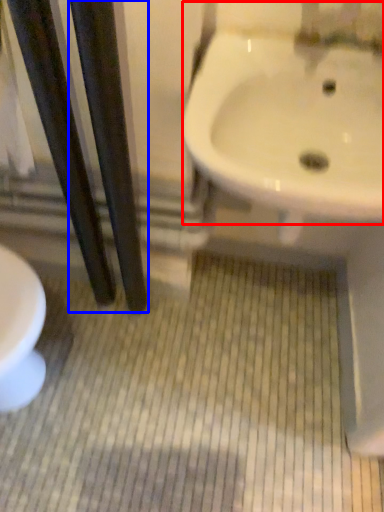
Question: Which point is further to the camera, sink (highlighted by a red box) or pole (highlighted by a blue box)?

Choices:
 (A) sink
 (B) pole

Answer: (A)